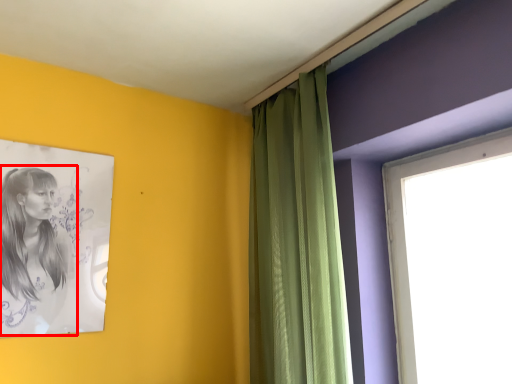
Question: From the image's perspective, considering the relative positions of woman (annotated by the red box) and curtain in the image provided, where is woman (annotated by the red box) located with respect to the staircase?

Choices:
 (A) below
 (B) above

Answer: (A)